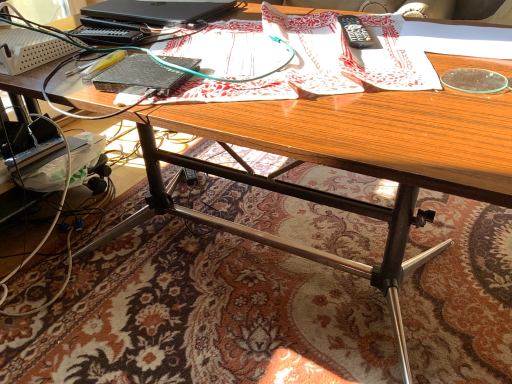
Find the location of `vacant space situated on the left part of black plastic remote control at upper right`. vacant space situated on the left part of black plastic remote control at upper right is located at coordinates (279, 41).